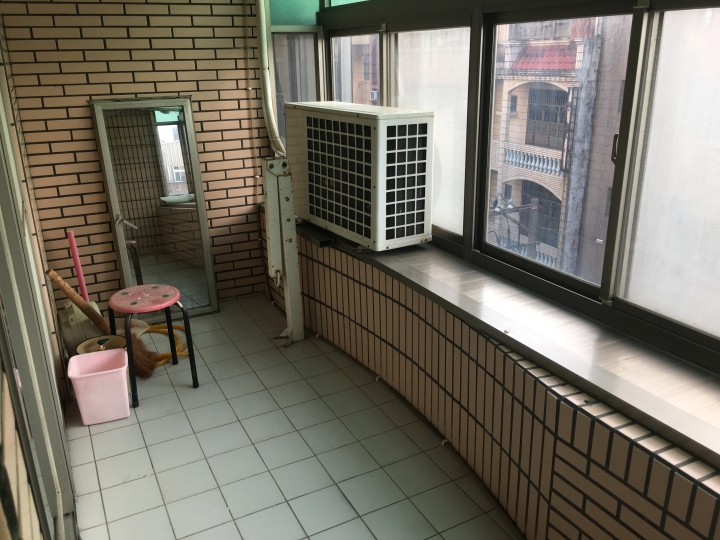
At what (x,y) coordinates should I click in order to perform the action: click on windowsill. Please return your answer as a coordinate pair (x, y). The height and width of the screenshot is (540, 720). Looking at the image, I should click on (502, 301).